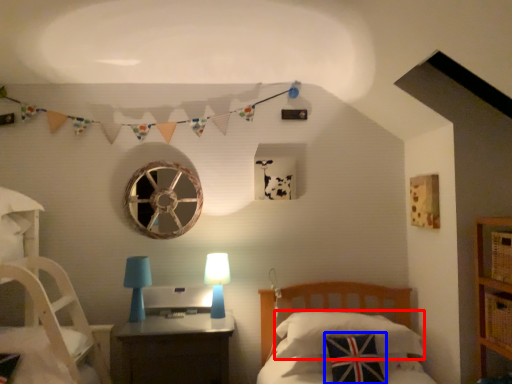
Question: Which object is further to the camera taking this photo, pillow (highlighted by a red box) or pillow (highlighted by a blue box)?

Choices:
 (A) pillow
 (B) pillow

Answer: (A)